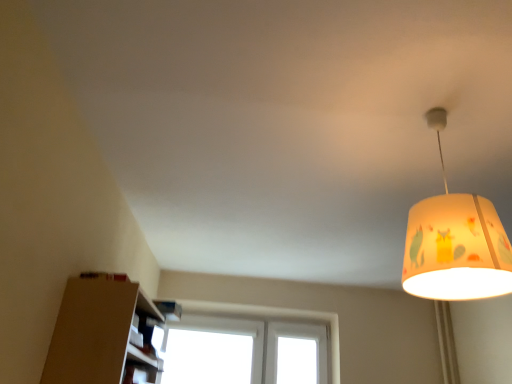
The height and width of the screenshot is (384, 512). Describe the element at coordinates (455, 243) in the screenshot. I see `yellow fabric lampshade at upper right` at that location.

Locate an element on the screen. The image size is (512, 384). yellow fabric lampshade at upper right is located at coordinates (455, 243).

At what (x,y) coordinates should I click in order to perform the action: click on white plastic window at center. Please return your answer as a coordinate pair (x, y). The image size is (512, 384). Looking at the image, I should click on (276, 317).

What is the approximate width of white plastic window at center?

white plastic window at center is 5.08 inches in width.

Describe the element at coordinates (276, 317) in the screenshot. I see `white plastic window at center` at that location.

You are a GUI agent. You are given a task and a screenshot of the screen. Output one action in this format:
    pyautogui.click(x=<x>, y=<y>)
    Task: Click on the yellow fabric lampshade at upper right
    
    Given the screenshot: What is the action you would take?
    pyautogui.click(x=455, y=243)

Can you confirm if yellow fabric lampshade at upper right is positioned to the right of white plastic window at center?

Correct, you'll find yellow fabric lampshade at upper right to the right of white plastic window at center.

Which object is further away from the camera taking this photo, yellow fabric lampshade at upper right or white plastic window at center?

white plastic window at center is behind.

Does point (416, 212) come behind point (255, 312)?

No, it is in front of (255, 312).

From the image's perspective, is yellow fabric lampshade at upper right over white plastic window at center?

Yes, from the image's perspective, yellow fabric lampshade at upper right is on top of white plastic window at center.

From a real-world perspective, who is located higher, yellow fabric lampshade at upper right or white plastic window at center?

yellow fabric lampshade at upper right is physically above.

Considering the sizes of yellow fabric lampshade at upper right and white plastic window at center in the image, is yellow fabric lampshade at upper right wider or thinner than white plastic window at center?

Considering their sizes, yellow fabric lampshade at upper right looks broader than white plastic window at center.

Considering the sizes of objects yellow fabric lampshade at upper right and white plastic window at center in the image provided, who is shorter, yellow fabric lampshade at upper right or white plastic window at center?

yellow fabric lampshade at upper right.

Does yellow fabric lampshade at upper right have a smaller size compared to white plastic window at center?

Correct, yellow fabric lampshade at upper right occupies less space than white plastic window at center.

In the scene shown: Is yellow fabric lampshade at upper right located outside white plastic window at center?

Yes, yellow fabric lampshade at upper right is not within white plastic window at center.

Are yellow fabric lampshade at upper right and white plastic window at center beside each other?

yellow fabric lampshade at upper right is not next to white plastic window at center, and they're not touching.

Could you tell me if yellow fabric lampshade at upper right is facing white plastic window at center?

No, yellow fabric lampshade at upper right is not aimed at white plastic window at center.

How many degrees apart are the facing directions of yellow fabric lampshade at upper right and white plastic window at center?

The facing directions of yellow fabric lampshade at upper right and white plastic window at center are 90 degrees apart.

At what (x,y) coordinates should I click in order to perform the action: click on lamp lying on the right of white plastic window at center. Please return your answer as a coordinate pair (x, y). The image size is (512, 384). Looking at the image, I should click on (455, 243).

Is white plastic window at center to the left or to the right of yellow fabric lampshade at upper right in the image?

white plastic window at center is to the left of yellow fabric lampshade at upper right.

Is white plastic window at center positioned in front of yellow fabric lampshade at upper right?

No, it is not.

Is point (207, 301) positioned before point (460, 283)?

No.

From the picture: From the image's perspective, which object appears higher, white plastic window at center or yellow fabric lampshade at upper right?

From the image's view, yellow fabric lampshade at upper right is above.

From a real-world perspective, is white plastic window at center physically above yellow fabric lampshade at upper right?

No, from a real-world perspective, white plastic window at center is not on top of yellow fabric lampshade at upper right.

Considering the sizes of objects white plastic window at center and yellow fabric lampshade at upper right in the image provided, who is thinner, white plastic window at center or yellow fabric lampshade at upper right?

With smaller width is white plastic window at center.

Considering the relative sizes of white plastic window at center and yellow fabric lampshade at upper right in the image provided, is white plastic window at center shorter than yellow fabric lampshade at upper right?

In fact, white plastic window at center may be taller than yellow fabric lampshade at upper right.

Does white plastic window at center have a larger size compared to yellow fabric lampshade at upper right?

Yes.

Is white plastic window at center not within yellow fabric lampshade at upper right?

Absolutely, white plastic window at center is external to yellow fabric lampshade at upper right.

Consider the image. Is the surface of white plastic window at center in direct contact with yellow fabric lampshade at upper right?

They are not placed beside each other.

Is white plastic window at center looking in the opposite direction of yellow fabric lampshade at upper right?

white plastic window at center does not have its back to yellow fabric lampshade at upper right.

Can you tell me how much white plastic window at center and yellow fabric lampshade at upper right differ in facing direction?

90 degrees separate the facing orientations of white plastic window at center and yellow fabric lampshade at upper right.

Where is `window lying on the left of yellow fabric lampshade at upper right`? This screenshot has width=512, height=384. window lying on the left of yellow fabric lampshade at upper right is located at coordinates (276, 317).

At what (x,y) coordinates should I click in order to perform the action: click on lamp to the right of white plastic window at center. Please return your answer as a coordinate pair (x, y). This screenshot has height=384, width=512. Looking at the image, I should click on (455, 243).

This screenshot has height=384, width=512. What are the coordinates of `window lying on the left of yellow fabric lampshade at upper right` in the screenshot? It's located at (276, 317).